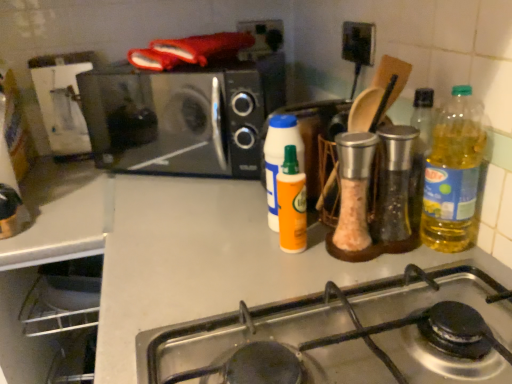
Where is `vacant space in front of black matte microwave at upper left`? The image size is (512, 384). vacant space in front of black matte microwave at upper left is located at coordinates (178, 220).